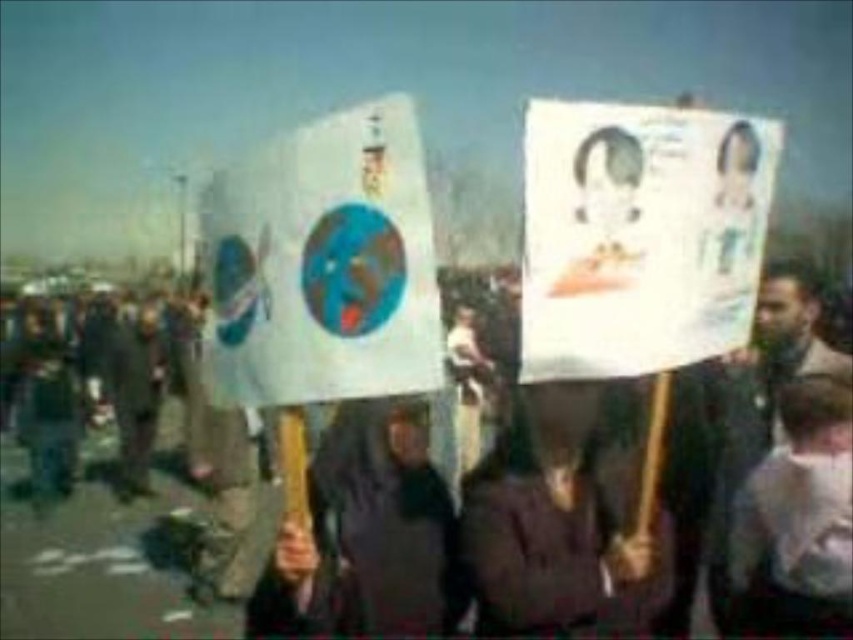
You are a photographer trying to capture both the white paper poster at upper center and the dark brown fabric at center in a single frame. Based on their positions, which object should you adjust your camera to focus on first to ensure both are in the shot?

You should focus on the dark brown fabric at center first since the white paper poster at upper center is to the right of it, allowing you to adjust the frame to include both.

Based on the photo, you are a photographer trying to capture a clear shot of both the white paper poster at upper center and the white cotton shirt at center. Since you want to ensure both are visible, which object should you focus on first to avoid blurriness?

The white paper poster at upper center is larger in size than the white cotton shirt at center, so focusing on the larger poster first would ensure it is sharp, then adjust for the smaller shirt to keep both in focus.

You are a photographer trying to capture both the white paper poster at upper center and the white cardboard poster at center in a single frame. Based on their positions, which poster should you focus on first to ensure both are in the shot?

The white paper poster at upper center is above the white cardboard poster at center, so you should focus on the white cardboard poster at center first to ensure both are in the frame, as it is lower and closer to the center of the image.